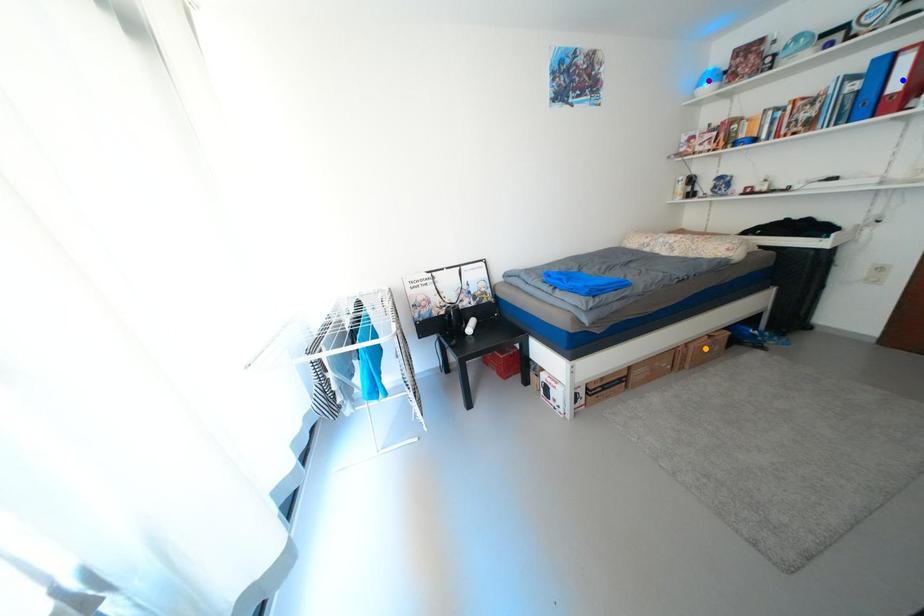
Order these from farthest to nearest:
A) orange point
B) purple point
C) blue point

1. purple point
2. orange point
3. blue point